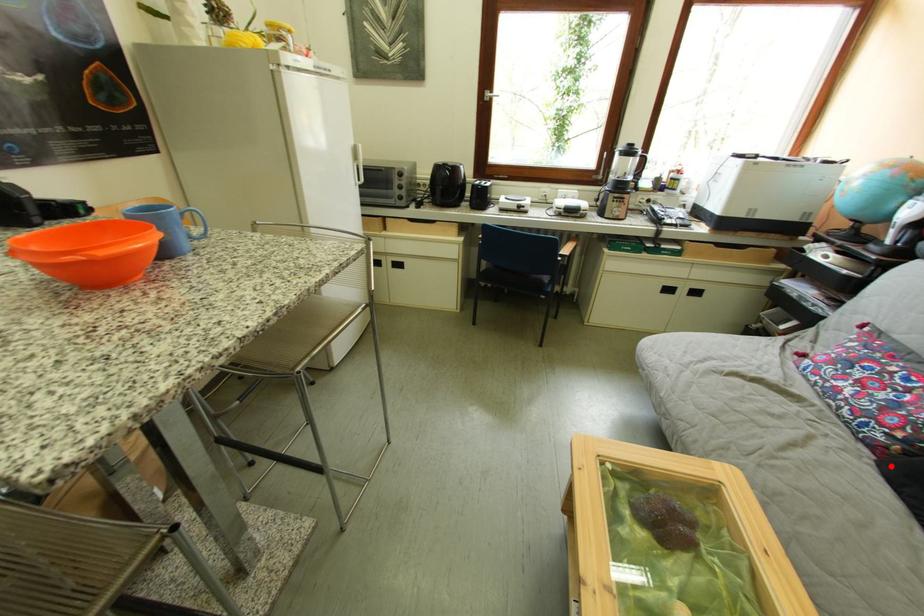
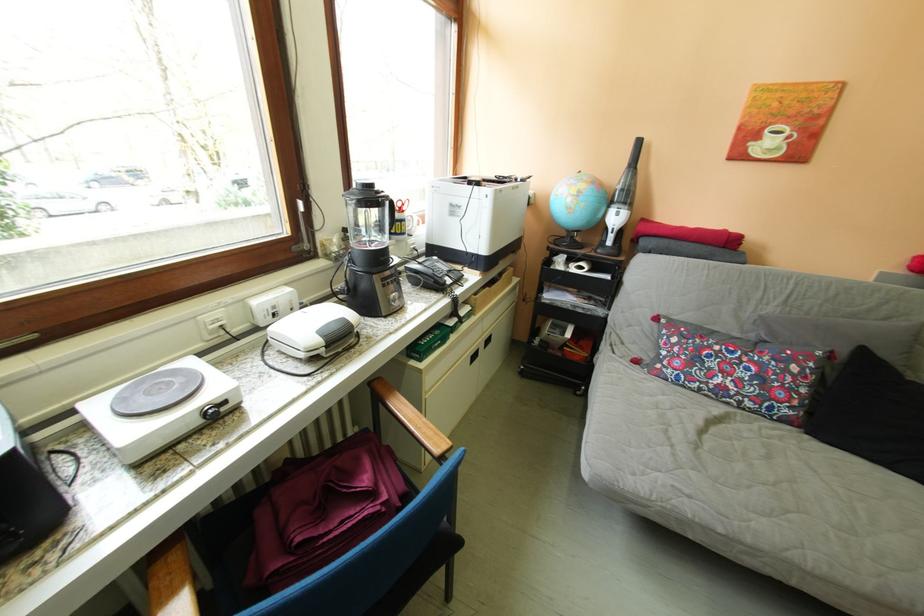
Question: I am providing you with two images of the same scene from different viewpoints. Image1 has a red point marked. In image2, the corresponding 3D location appears at what relative position? Reply with the corresponding letter.

Choices:
 (A) Closer
 (B) Farther

Answer: (A)